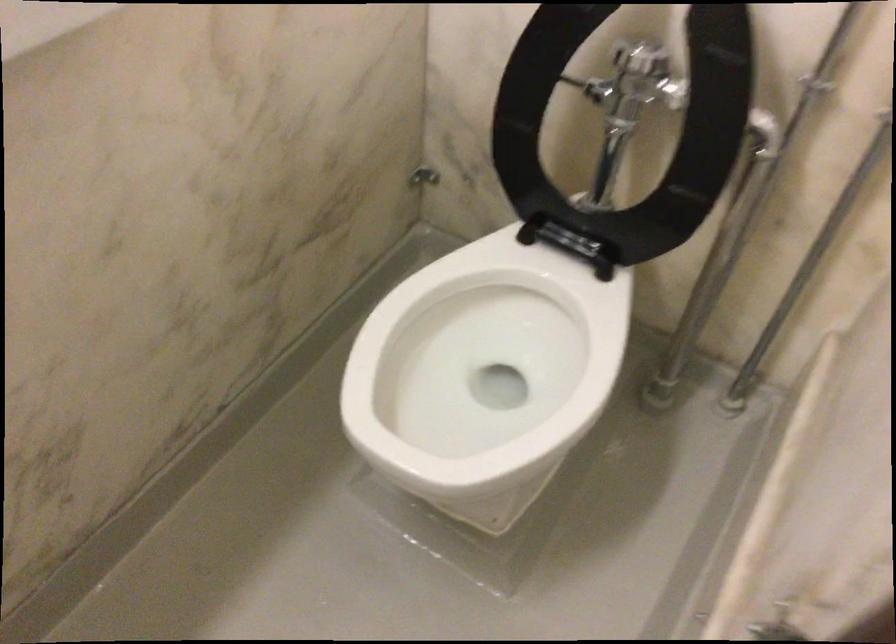
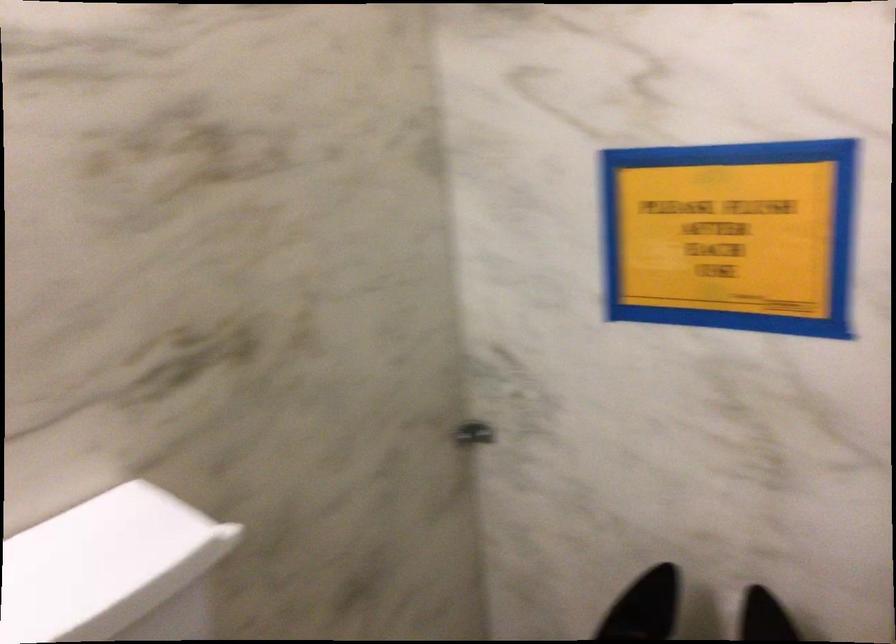
Question: The first image is from the beginning of the video and the second image is from the end. How did the camera likely rotate when shooting the video?

Choices:
 (A) Left
 (B) Right
 (C) Up
 (D) Down

Answer: (C)